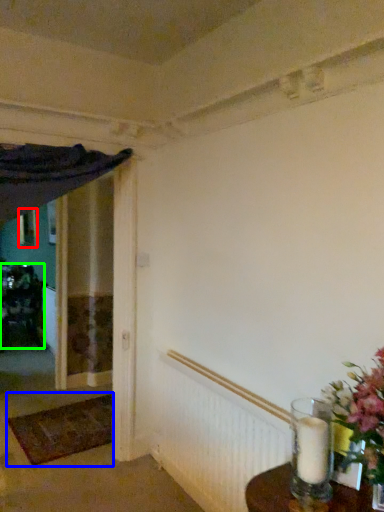
Question: Estimate the real-world distances between objects in this image. Which object is closer to picture frame (highlighted by a red box), doormat (highlighted by a blue box) or furniture (highlighted by a green box)?

Choices:
 (A) doormat
 (B) furniture

Answer: (B)